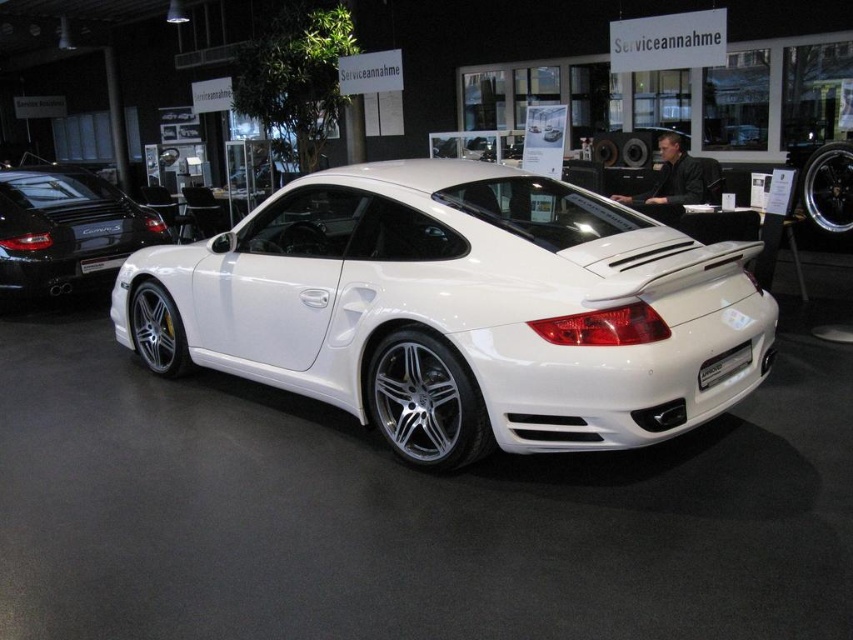
Question: Can you confirm if white glossy sports car at center is positioned below white metallic car at center?

Choices:
 (A) yes
 (B) no

Answer: (A)

Question: Where is white metallic car at center located in relation to white metallic license plate at rear in the image?

Choices:
 (A) above
 (B) below

Answer: (A)

Question: Can you confirm if white matte porsche at center is positioned above white metallic license plate at rear?

Choices:
 (A) no
 (B) yes

Answer: (B)

Question: Which is nearer to the white matte porsche at center?

Choices:
 (A) white metallic license plate at rear
 (B) white metallic car at center
 (C) white glossy license plate at center

Answer: (A)

Question: Which object appears closest to the camera in this image?

Choices:
 (A) white metallic car at center
 (B) white matte porsche at center
 (C) white glossy sports car at center

Answer: (C)

Question: Considering the real-world distances, which object is farthest from the white glossy license plate at center?

Choices:
 (A) white glossy sports car at center
 (B) white metallic license plate at rear

Answer: (B)